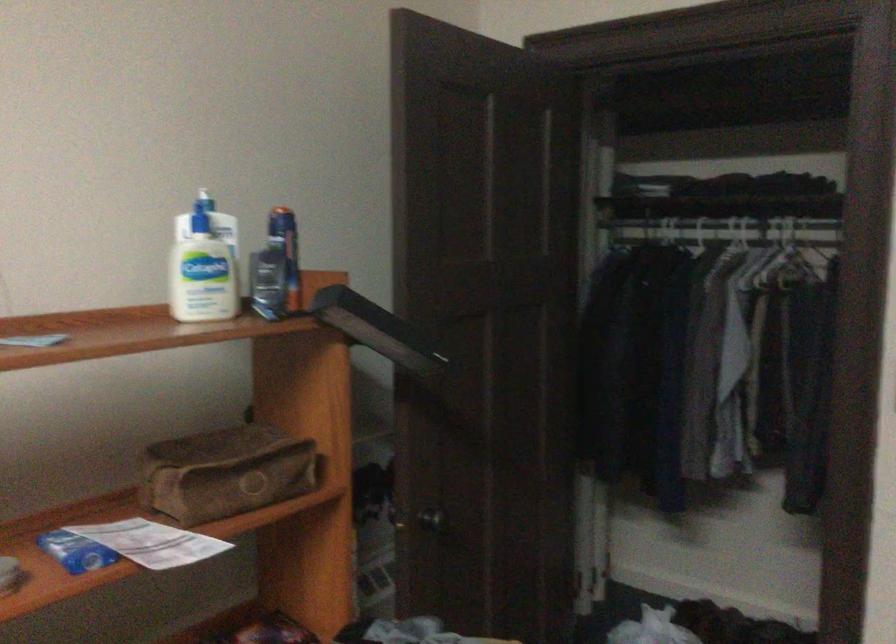
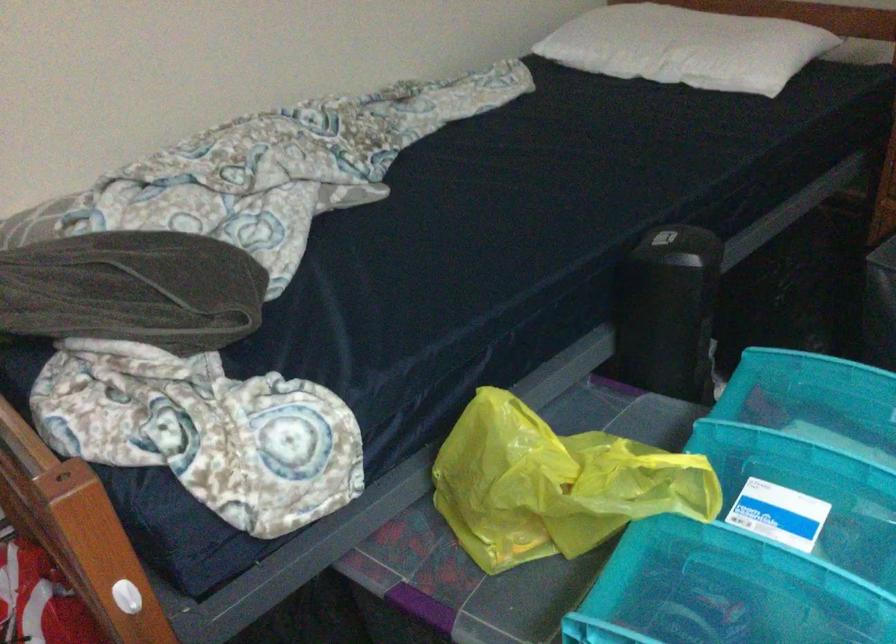
The images are taken continuously from a first-person perspective. In which direction is your viewpoint rotating?

The rotation direction of the camera is right-down.